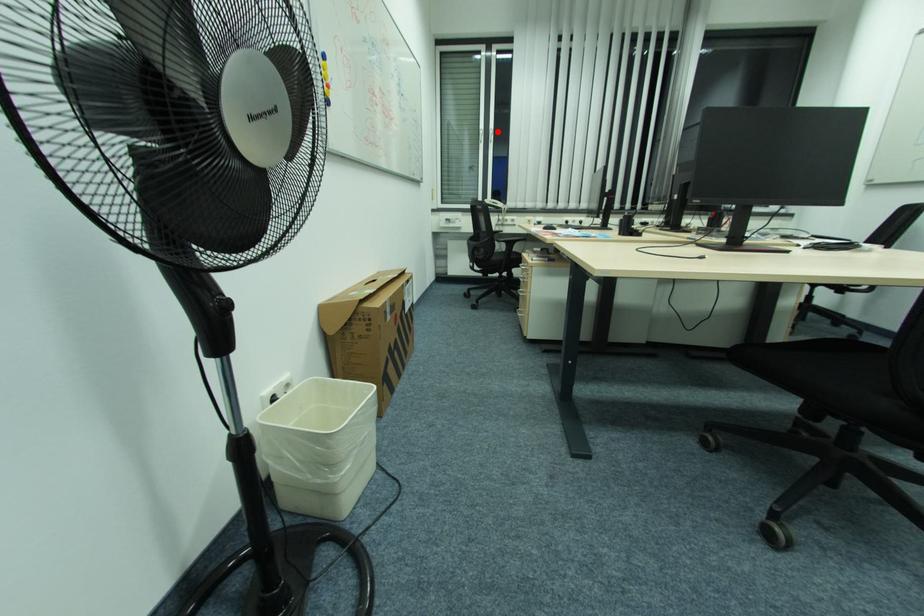
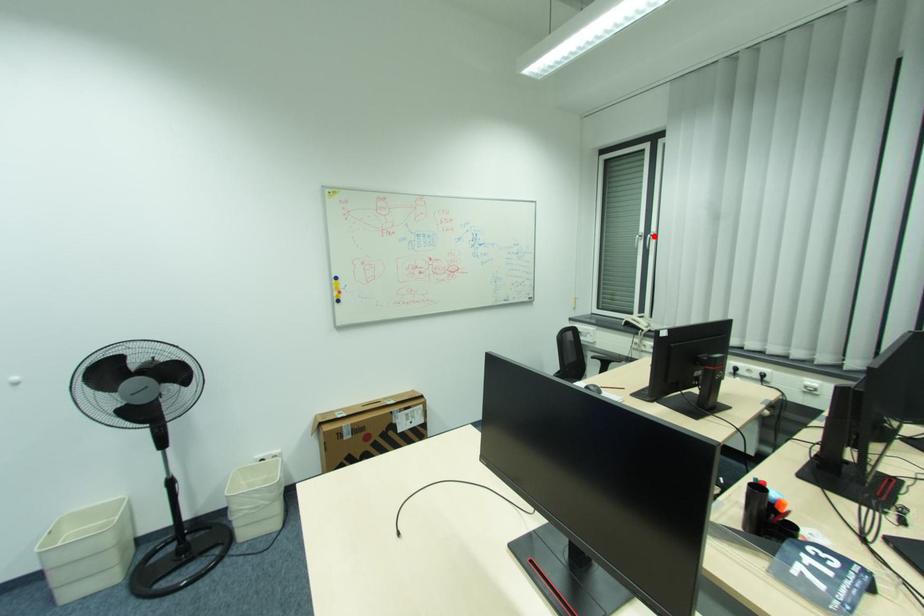
I am providing you with two images of the same scene from different viewpoints. A red point is marked on the first image and another point is marked on the second image. Do the highlighted points in image1 and image2 indicate the same real-world spot?

Yes